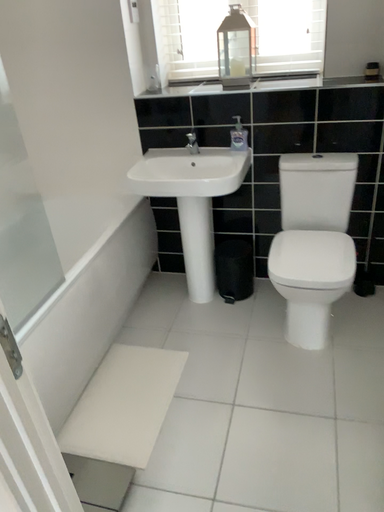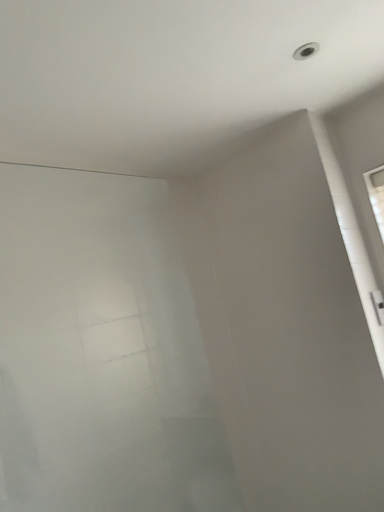
Question: Which way did the camera rotate in the video?

Choices:
 (A) rotated upward
 (B) rotated downward

Answer: (A)